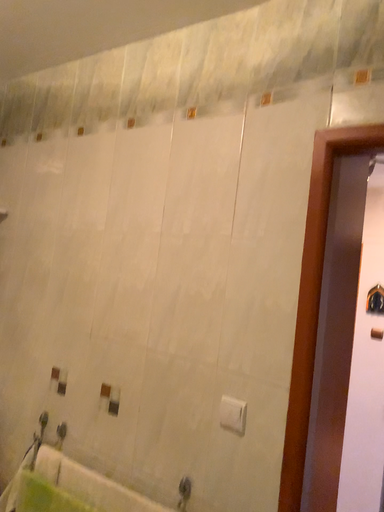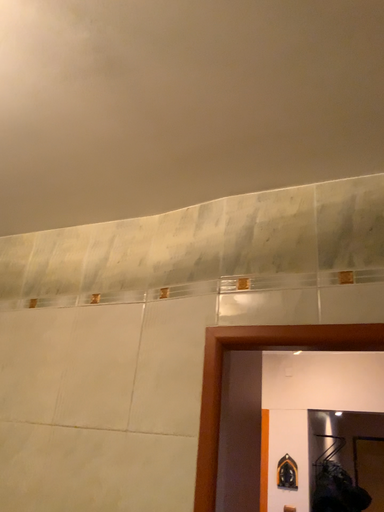
Question: Which way did the camera rotate in the video?

Choices:
 (A) rotated upward
 (B) rotated downward

Answer: (A)